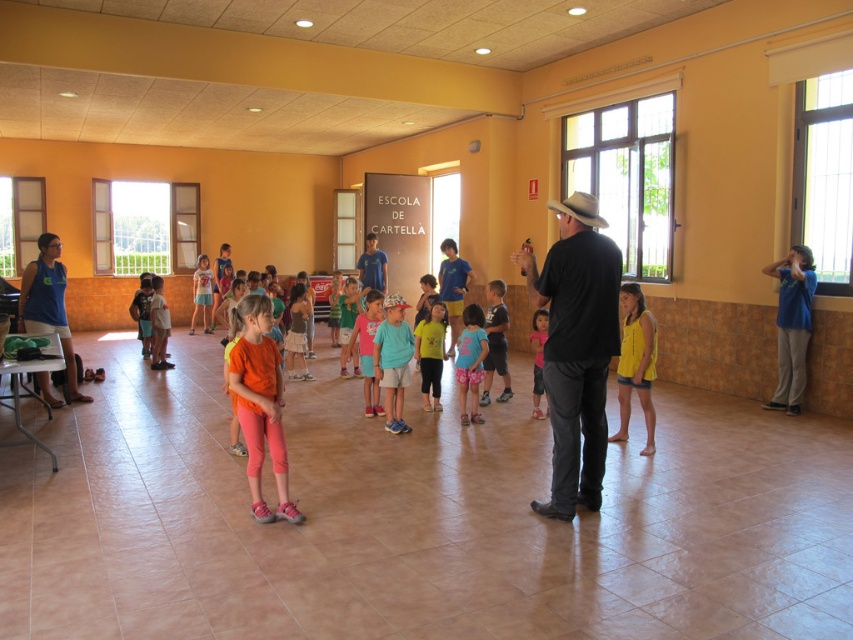
In the scene shown: You are a photographer trying to capture a group photo of the children in the scene. You want to ensure both the dark blue shirt at center and the matte pink shirt at center are visible in the frame. Which child should you position closer to the left side of the camera to avoid overlapping?

To avoid overlapping, position the matte pink shirt at center closer to the left side of the camera since the dark blue shirt at center is already on its right side.